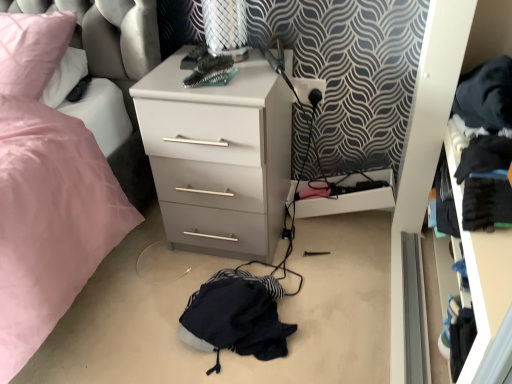
At what (x,y) coordinates should I click in order to perform the action: click on empty space that is in between matte gray chest of drawers at center and white plastic drawer at lower center. Please return your answer as a coordinate pair (x, y). Image resolution: width=512 pixels, height=384 pixels. Looking at the image, I should click on (316, 244).